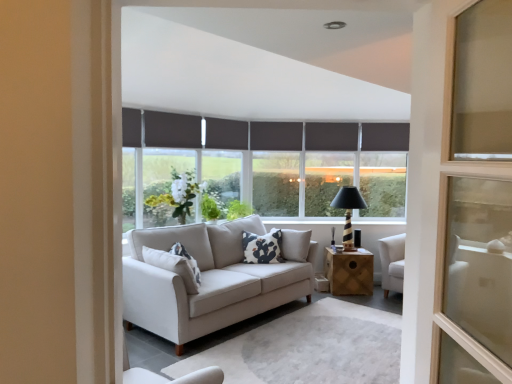
Image resolution: width=512 pixels, height=384 pixels. I want to click on free point below dark grey fabric curtain at upper center, the 1th curtain from the left (from a real-world perspective), so click(169, 162).